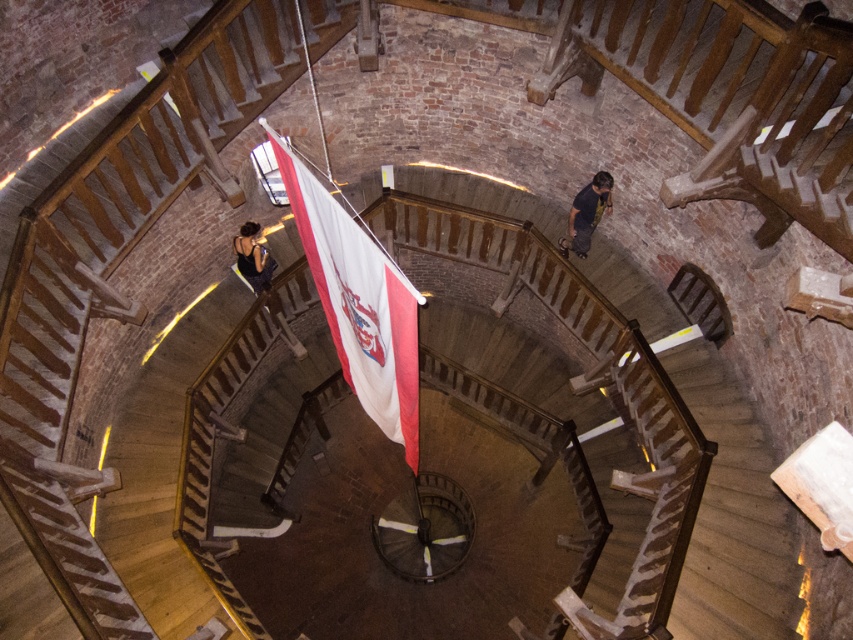
Is the position of white fabric flag at center more distant than that of black fabric at lower left?

No.

Find the location of a particular element. The image size is (853, 640). white fabric flag at center is located at coordinates (358, 304).

Can you confirm if white fabric flag at center is smaller than dark blue shirt at center?

No, white fabric flag at center is not smaller than dark blue shirt at center.

Does white fabric flag at center have a lesser height compared to dark blue shirt at center?

Incorrect, white fabric flag at center's height does not fall short of dark blue shirt at center's.

Who is more forward, (341, 256) or (579, 234)?

Positioned in front is point (341, 256).

I want to click on white fabric flag at center, so point(358,304).

The height and width of the screenshot is (640, 853). I want to click on dark blue shirt at center, so click(x=585, y=212).

Is dark blue shirt at center shorter than black fabric at lower left?

Incorrect, dark blue shirt at center's height does not fall short of black fabric at lower left's.

Which is behind, point (607, 195) or point (253, 253)?

The point (253, 253) is more distant.

Image resolution: width=853 pixels, height=640 pixels. Find the location of `dark blue shirt at center`. dark blue shirt at center is located at coordinates (585, 212).